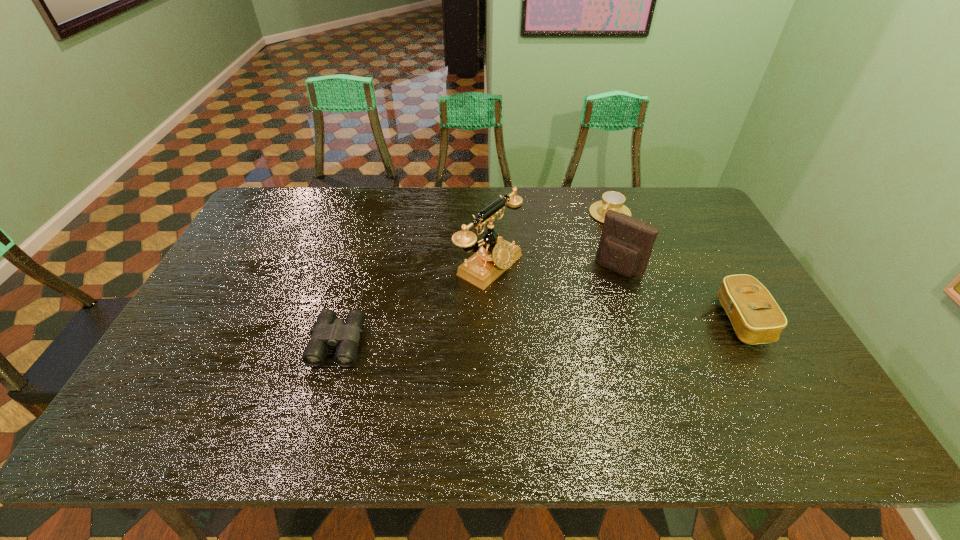
In order to click on vacant spot on the desktop that is between the leftmost object and the rightmost object and is positioned with an open flap on the second tallest object in this screenshot , I will do `click(579, 321)`.

The height and width of the screenshot is (540, 960). What are the coordinates of `vacant space on the desktop that is between the binoculars and the third shortest object and is positioned on the dial of the tallest object` in the screenshot? It's located at (591, 321).

The width and height of the screenshot is (960, 540). In order to click on free space on the desktop that is between the leftmost object and the third shortest object and is positioned with the handle on the side of the farthest object in this screenshot , I will do `click(488, 321)`.